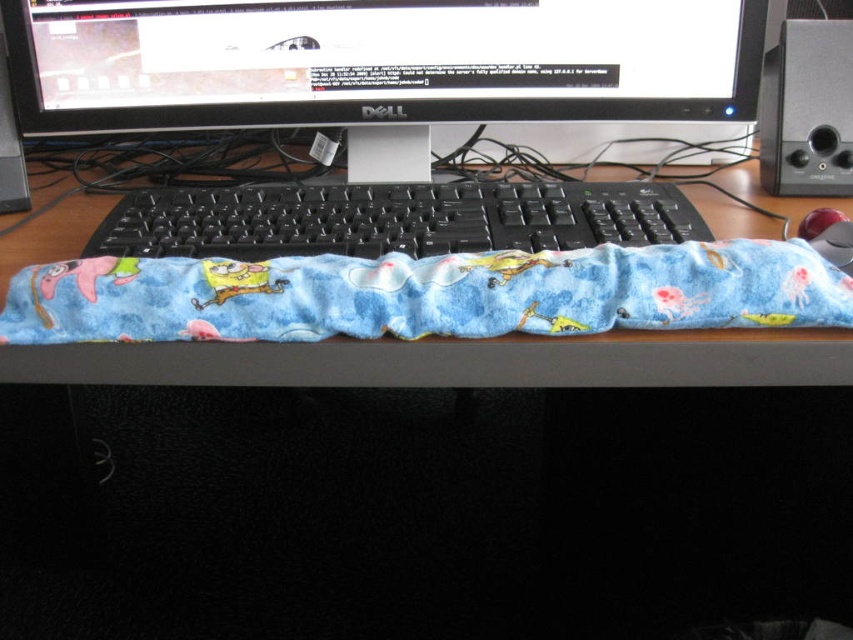
Question: Which object is positioned closest to the black plastic keyboard at center?

Choices:
 (A) blue fleece blanket at center
 (B) blue fleece keyboard cover at center

Answer: (A)

Question: Is blue fleece keyboard cover at center positioned in front of blue fleece blanket at center?

Choices:
 (A) yes
 (B) no

Answer: (B)

Question: Which point appears farthest from the camera in this image?

Choices:
 (A) (294, 216)
 (B) (352, 109)
 (C) (367, 298)

Answer: (B)

Question: Is the position of blue fleece blanket at center less distant than that of black plastic keyboard at center?

Choices:
 (A) yes
 (B) no

Answer: (A)

Question: Is blue fleece keyboard cover at center smaller than black plastic keyboard at center?

Choices:
 (A) yes
 (B) no

Answer: (B)

Question: Which point is farther to the camera?

Choices:
 (A) (381, 92)
 (B) (631, 244)
 (C) (341, 289)

Answer: (A)